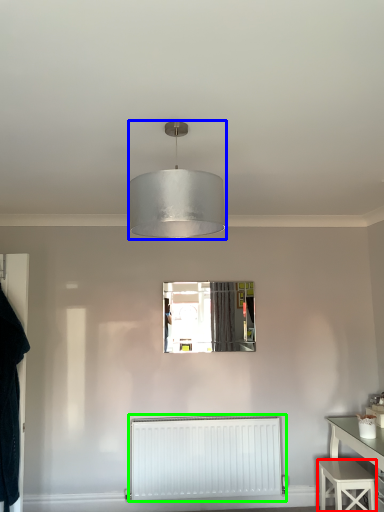
Question: Which object is the closest to the stool (highlighted by a red box)? Choose among these: lamp (highlighted by a blue box) or radiator (highlighted by a green box).

Choices:
 (A) lamp
 (B) radiator

Answer: (B)